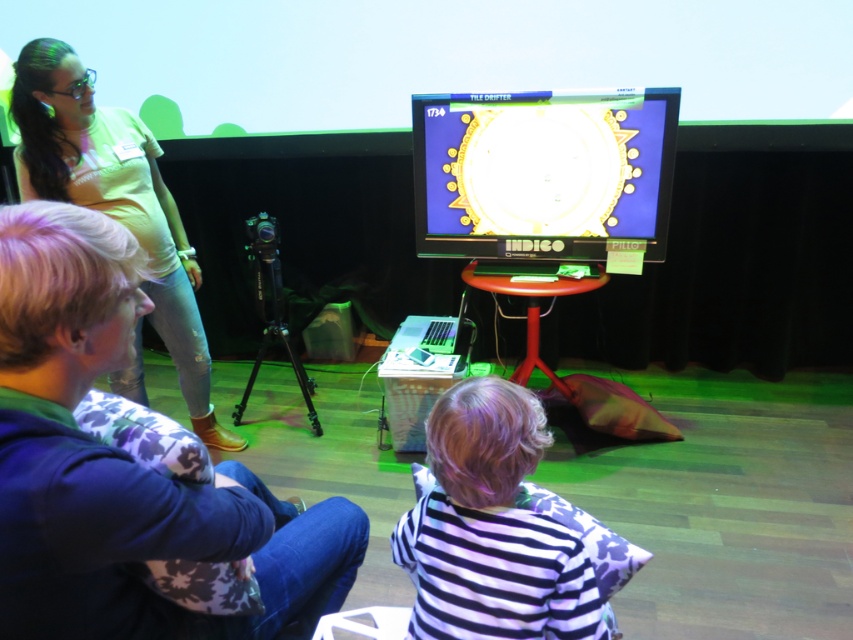
You are standing in the room and want to place a small decoration on the point that is closer to you. Which point should you choose between point (466, 621) and point (195, 275)?

Point (466, 621) is closer to the viewer than point (195, 275), so you should choose point (466, 621) to place the small decoration.

You are standing in the room and want to hand a controller to the person wearing the light beige cotton shirt at upper left. Which direction should you move relative to the matte plastic monitor at center to reach them?

The light beige cotton shirt at upper left is to the left of the matte plastic monitor at center, so you should move to the left side of the matte plastic monitor at center to reach them.